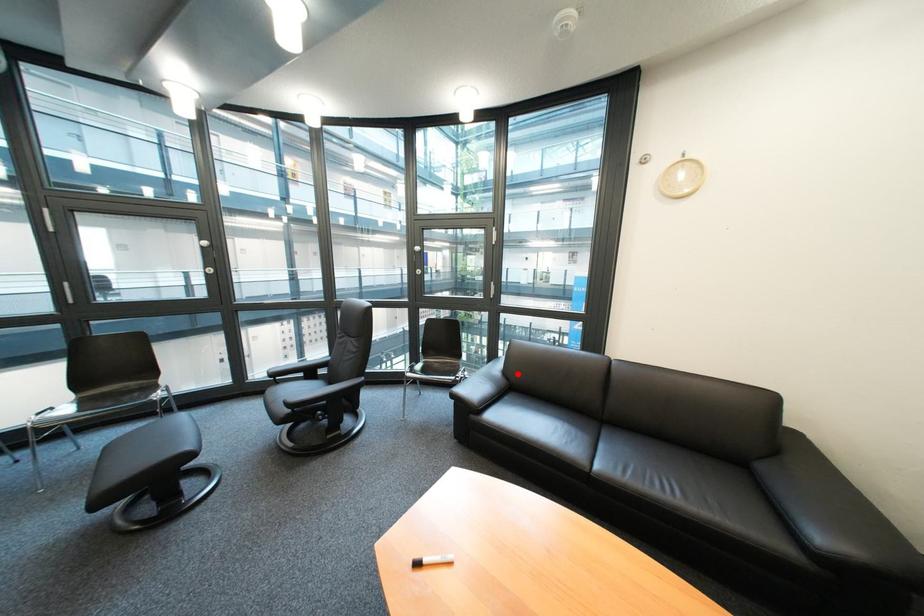
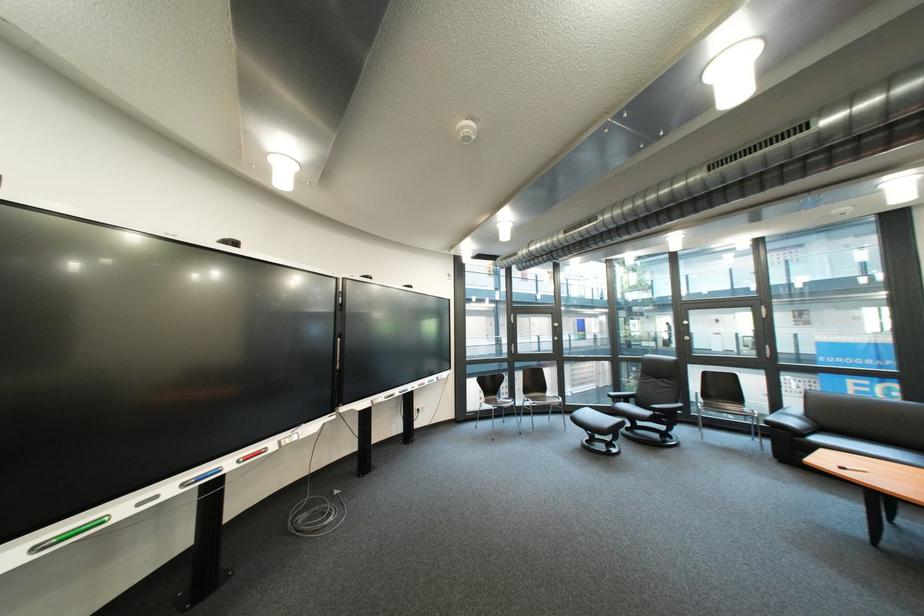
The point at the highlighted location is marked in the first image. Where is the corresponding point in the second image?

(822, 418)